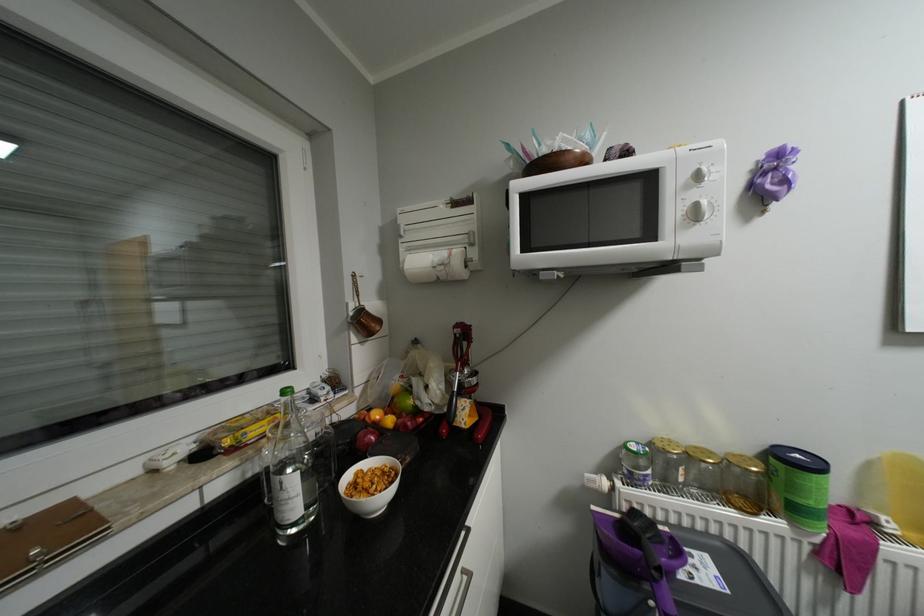
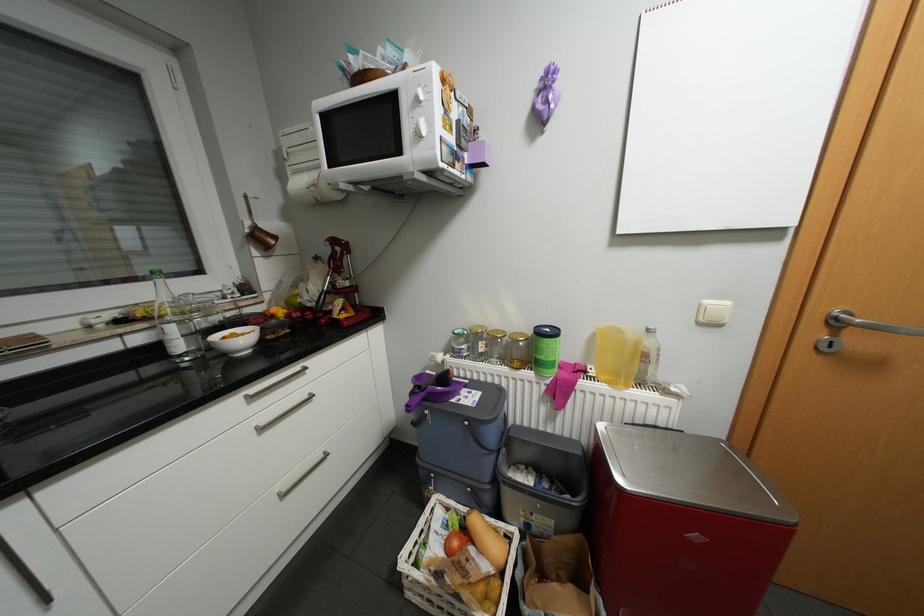
Locate, in the second image, the point that corresponds to point (626, 482) in the first image.

(456, 355)